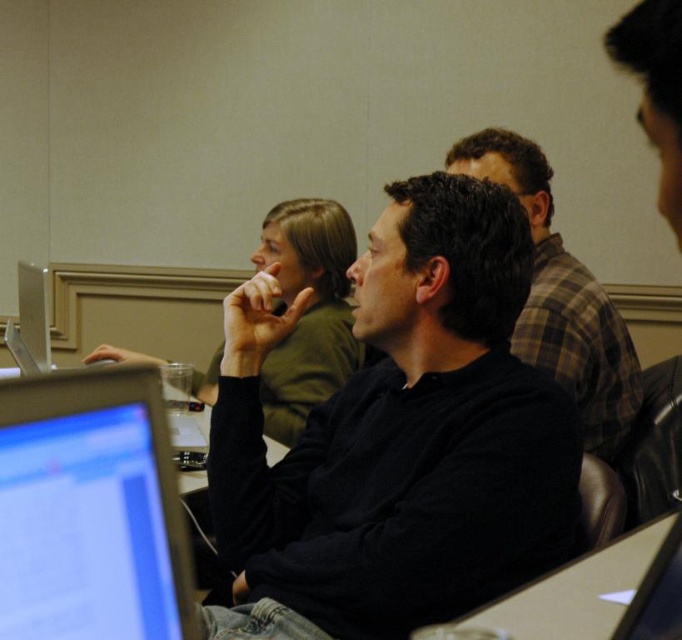
You are a student sitting at the back of the classroom. You want to see the matte black monitor at lower left clearly. Can you see it over the black matte shirt at center?

The matte black monitor at lower left is behind the black matte shirt at center, so it is obstructed and cannot be seen clearly from the back.

You are standing in the classroom and want to reach the point at coordinates point (x=415, y=611). If your maximum reach is 3.5 feet, can you comfortably touch it without moving your feet?

The distance of point (x=415, y=611) from viewer is 3.62 feet, which is slightly beyond your maximum reach of 3.5 feet. You cannot comfortably touch it without moving your feet.

You are organizing a photo shoot and need to ensure that the black matte shirt at center and the plaid fabric shirt at upper center are visible in the frame. Given their sizes, which shirt should you adjust the camera angle to focus on first to ensure both are in the shot?

The black matte shirt at center is wider than the plaid fabric shirt at upper center. To ensure both are visible, focus on the wider black matte shirt at center first, then adjust the angle to include the smaller plaid fabric shirt at upper center.